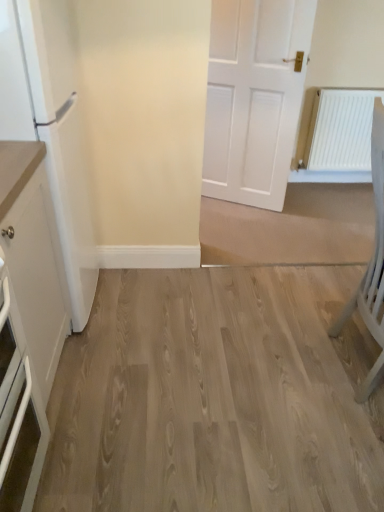
Image resolution: width=384 pixels, height=512 pixels. In order to click on light wood flooring at center in this screenshot , I will do `click(216, 396)`.

Where is `white matte cabinet at left`? The height and width of the screenshot is (512, 384). white matte cabinet at left is located at coordinates (27, 318).

The height and width of the screenshot is (512, 384). I want to click on white glossy refrigerator at left, so click(50, 128).

Locate an element on the screen. This screenshot has width=384, height=512. light wood flooring at center is located at coordinates (216, 396).

Which object is closer to the camera taking this photo, white glossy refrigerator at left or white matte radiator at right?

white glossy refrigerator at left is in front.

Which of these two, white glossy refrigerator at left or white matte radiator at right, is wider?

With larger width is white glossy refrigerator at left.

Considering the sizes of objects white glossy refrigerator at left and white matte radiator at right in the image provided, who is bigger, white glossy refrigerator at left or white matte radiator at right?

With larger size is white glossy refrigerator at left.

From a real-world perspective, is white glossy refrigerator at left located higher than light wood flooring at center?

Yes, from a real-world perspective, white glossy refrigerator at left is over light wood flooring at center

Would you say white glossy refrigerator at left contains light wood flooring at center?

No, light wood flooring at center is not inside white glossy refrigerator at left.

Does white glossy refrigerator at left lie in front of light wood flooring at center?

Yes, it is.

From the picture: How distant is white glossy refrigerator at left from light wood flooring at center?

white glossy refrigerator at left is 75.88 centimeters away from light wood flooring at center.

Is there a large distance between white matte radiator at right and light gray wooden chair at right?

Yes, white matte radiator at right is far from light gray wooden chair at right.

Can you confirm if white matte radiator at right is wider than light gray wooden chair at right?

No.

Is white matte radiator at right closer to camera compared to light gray wooden chair at right?

No, it is not.

Can you tell me how much white matte radiator at right and light gray wooden chair at right differ in facing direction?

white matte radiator at right and light gray wooden chair at right are facing 90.6 degrees away from each other.

From a real-world perspective, is white matte radiator at right beneath white glossy refrigerator at left?

Yes, from a real-world perspective, white matte radiator at right is below white glossy refrigerator at left.

Looking at this image, who is taller, white matte radiator at right or white glossy refrigerator at left?

With more height is white glossy refrigerator at left.

Which is behind, point (339, 115) or point (90, 272)?

The point (339, 115) is behind.

Is white matte radiator at right further to the viewer compared to white glossy refrigerator at left?

Yes, it is behind white glossy refrigerator at left.

Is light wood flooring at center further to camera compared to light gray wooden chair at right?

Yes, light wood flooring at center is further from the camera.

Does point (179, 504) appear closer or farther from the camera than point (382, 360)?

Point (179, 504) appears to be closer to the viewer than point (382, 360).

Is light wood flooring at center at the left side of light gray wooden chair at right?

Correct, you'll find light wood flooring at center to the left of light gray wooden chair at right.

Between light wood flooring at center and light gray wooden chair at right, which one has less height?

light wood flooring at center.

Considering the relative positions of light wood flooring at center and white matte cabinet at left in the image provided, is light wood flooring at center to the right of white matte cabinet at left from the viewer's perspective?

Indeed, light wood flooring at center is positioned on the right side of white matte cabinet at left.

Relative to white matte cabinet at left, is light wood flooring at center in front or behind?

Visually, light wood flooring at center is located behind white matte cabinet at left.

Is point (131, 305) closer to viewer compared to point (6, 393)?

No, (131, 305) is behind (6, 393).

In order to click on cabinetry in front of the light wood flooring at center in this screenshot , I will do `click(27, 318)`.

Can you confirm if light gray wooden chair at right is taller than white glossy refrigerator at left?

Incorrect, the height of light gray wooden chair at right is not larger of that of white glossy refrigerator at left.

What's the angular difference between light gray wooden chair at right and white glossy refrigerator at left's facing directions?

2.32 degrees separate the facing orientations of light gray wooden chair at right and white glossy refrigerator at left.

In the image, there is a white glossy refrigerator at left. Identify the location of chair below it (from the image's perspective). The height and width of the screenshot is (512, 384). (371, 264).

Identify the location of radiator behind the white glossy refrigerator at left. (341, 130).

I want to click on hardwood that appears on the right of white glossy refrigerator at left, so click(x=216, y=396).

Looking at this image, from the image, which object appears to be nearer to light gray wooden chair at right, white matte cabinet at left or white glossy refrigerator at left?

The object closer to light gray wooden chair at right is white glossy refrigerator at left.

When comparing their distances from light wood flooring at center, does white matte cabinet at left or white glossy refrigerator at left seem closer?

Among the two, white matte cabinet at left is located nearer to light wood flooring at center.

Considering their positions, is white glossy refrigerator at left positioned further to white matte radiator at right than white matte cabinet at left?

Among the two, white matte cabinet at left is located further to white matte radiator at right.

Which object lies nearer to the anchor point light wood flooring at center, light gray wooden chair at right or white matte cabinet at left?

light gray wooden chair at right lies closer to light wood flooring at center than the other object.

From the image, which object appears to be farther from light gray wooden chair at right, white glossy refrigerator at left or white matte radiator at right?

Among the two, white matte radiator at right is located further to light gray wooden chair at right.

Consider the image. Based on their spatial positions, is white matte radiator at right or light gray wooden chair at right closer to white matte cabinet at left?

Among the two, light gray wooden chair at right is located nearer to white matte cabinet at left.

When comparing their distances from white glossy refrigerator at left, does light wood flooring at center or light gray wooden chair at right seem closer?

light wood flooring at center is positioned closer to the anchor white glossy refrigerator at left.

When comparing their distances from white matte cabinet at left, does light gray wooden chair at right or white matte radiator at right seem closer?

Among the two, light gray wooden chair at right is located nearer to white matte cabinet at left.

Locate an element on the screen. fridge located between white matte cabinet at left and white matte radiator at right in the depth direction is located at coordinates (50, 128).

Identify the location of cabinetry between white glossy refrigerator at left and light gray wooden chair at right in the horizontal direction. (27, 318).

Where is `hardwood between light gray wooden chair at right and white matte radiator at right along the z-axis`? This screenshot has width=384, height=512. hardwood between light gray wooden chair at right and white matte radiator at right along the z-axis is located at coordinates (216, 396).

Find the location of `fridge positioned between light gray wooden chair at right and white matte radiator at right from near to far`. fridge positioned between light gray wooden chair at right and white matte radiator at right from near to far is located at coordinates (50, 128).